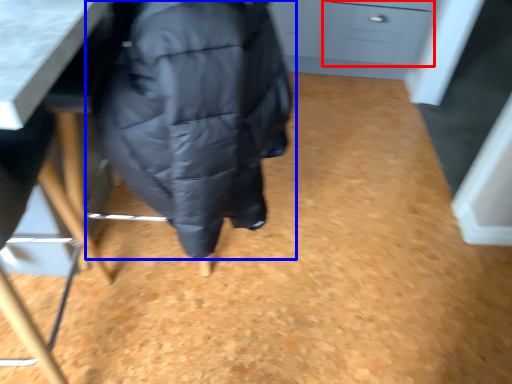
Question: Which object appears closest to the camera in this image, drawer (highlighted by a red box) or jacket (highlighted by a blue box)?

Choices:
 (A) drawer
 (B) jacket

Answer: (B)